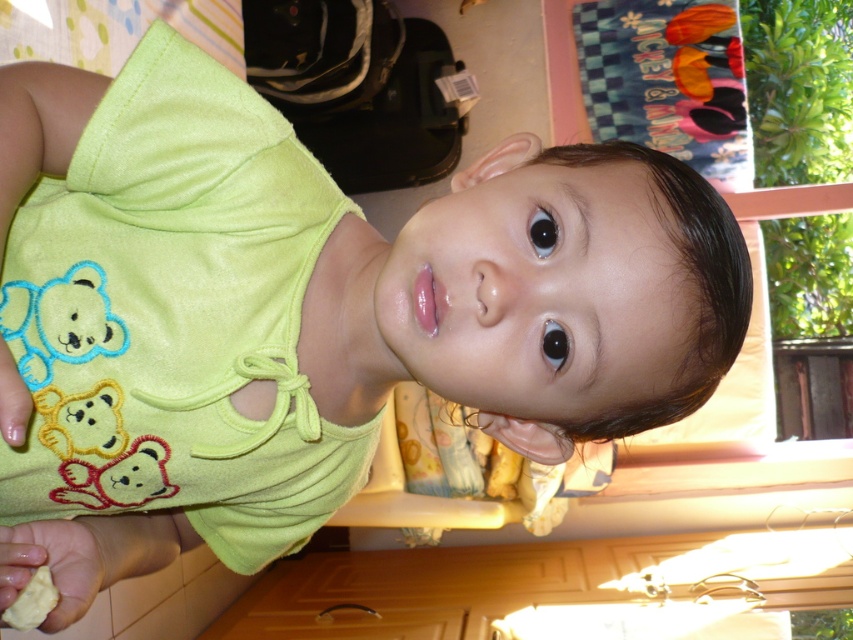
Is yellow matte cookie at lower left closer to the viewer compared to yellow matte food at lower left?

No, yellow matte cookie at lower left is behind yellow matte food at lower left.

Who is more forward, (79, 568) or (33, 612)?

Point (33, 612) is in front.

Who is more distant from viewer, (22, 540) or (45, 588)?

Point (22, 540)

Where is `yellow matte cookie at lower left`? The height and width of the screenshot is (640, 853). yellow matte cookie at lower left is located at coordinates (53, 564).